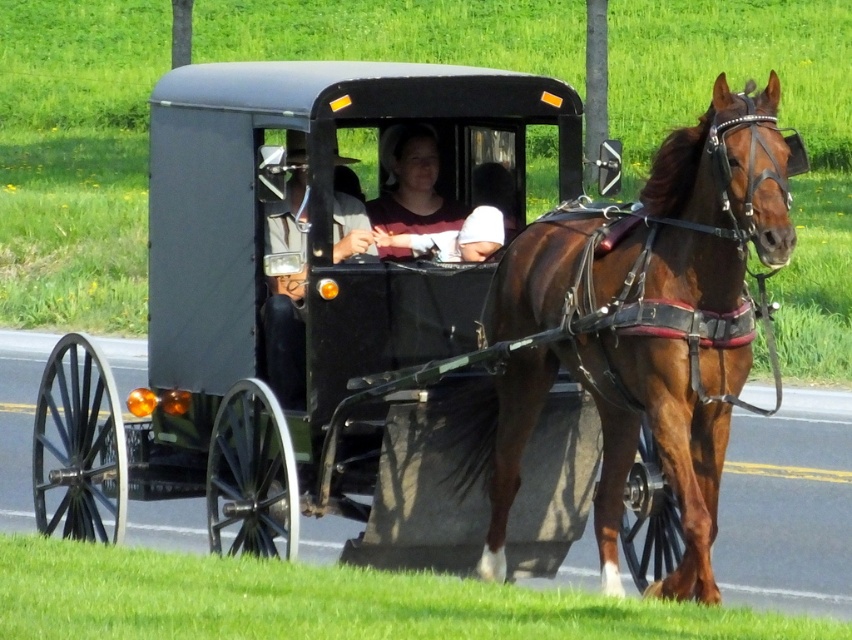
You are standing at the side of the road and want to take a photo of the brown glossy horse at center using a camera. The camera requires a minimum distance of 5 meters to focus properly. Can you take a clear photo from your current position?

The brown glossy horse at center and camera are 7.33 meters apart, so yes, you can take a clear photo since the distance is greater than the required 5 meters minimum focus distance.

Where is the brown glossy horse at center located in the image?

The brown glossy horse at center is located at the 2D coordinates point (634, 332) in the image.